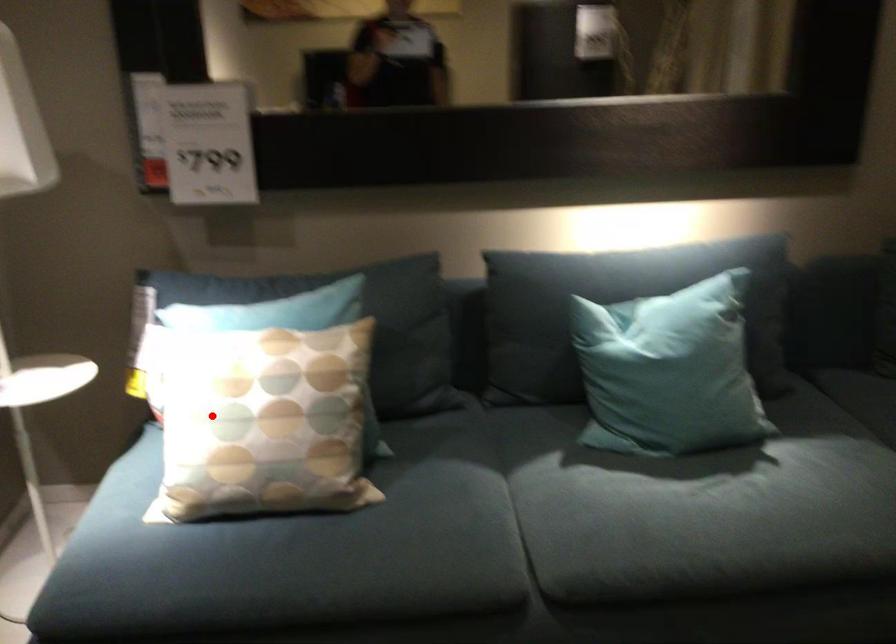
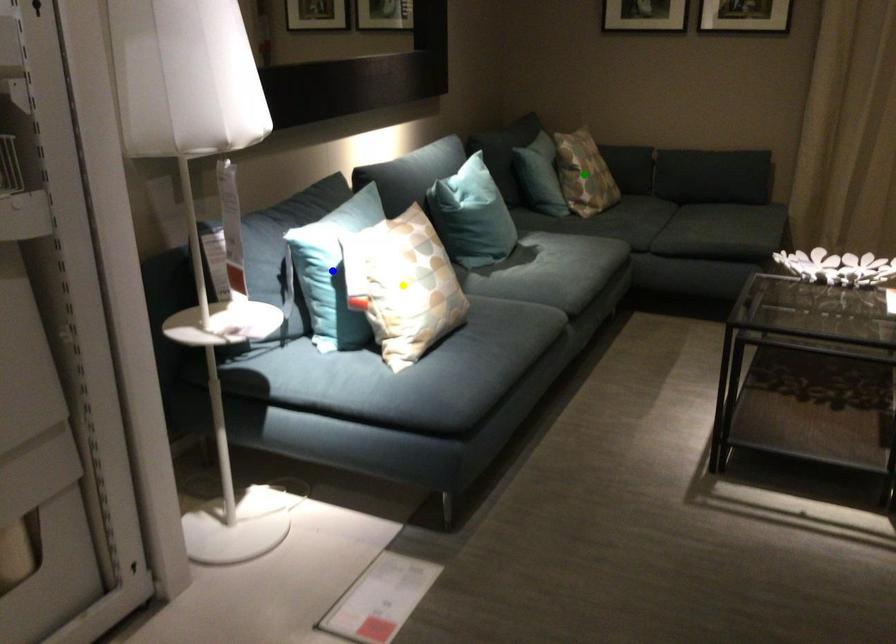
Question: I am providing you with two images of the same scene from different viewpoints. A red point is marked on the first image. You are given multiple points on the second image. Can you choose the point in image 2 that corresponds to the point in image 1?

Choices:
 (A) yellow point
 (B) green point
 (C) blue point

Answer: (A)